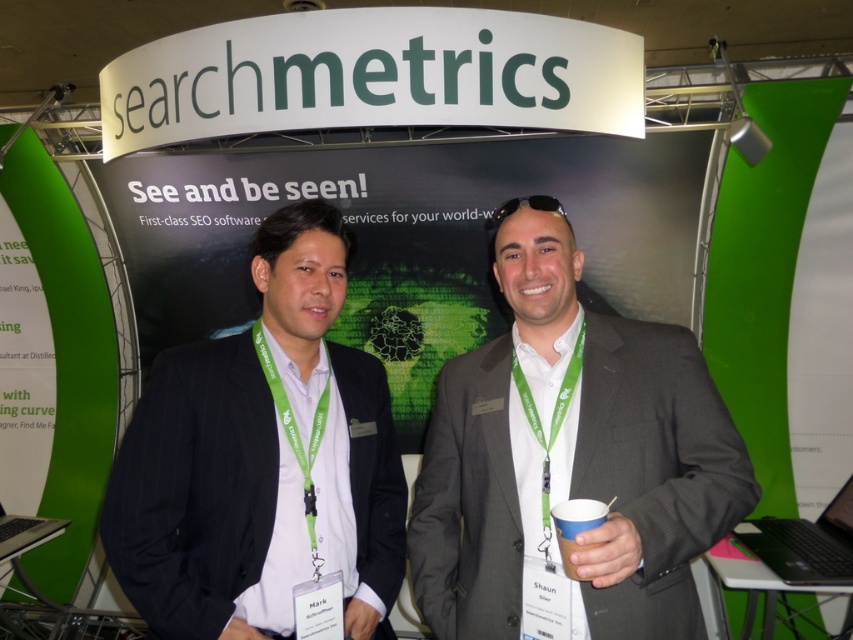
The image size is (853, 640). What do you see at coordinates (805, 544) in the screenshot?
I see `black plastic laptop at lower right` at bounding box center [805, 544].

Is the position of black plastic laptop at lower right more distant than that of blue paper cup at right?

Yes, it is.

The height and width of the screenshot is (640, 853). Describe the element at coordinates (805, 544) in the screenshot. I see `black plastic laptop at lower right` at that location.

Image resolution: width=853 pixels, height=640 pixels. What are the coordinates of `black plastic laptop at lower right` in the screenshot? It's located at (805, 544).

Between dark gray pinstripe suit at center and blue paper cup at right, which one is positioned lower?

blue paper cup at right

You are a GUI agent. You are given a task and a screenshot of the screen. Output one action in this format:
    pyautogui.click(x=<x>, y=<y>)
    Task: Click on the dark gray pinstripe suit at center
    
    Given the screenshot: What is the action you would take?
    pyautogui.click(x=260, y=460)

Where is `dark gray pinstripe suit at center`? dark gray pinstripe suit at center is located at coordinates (260, 460).

Who is positioned more to the right, gray suit at center or silver metallic laptop at lower left?

Positioned to the right is gray suit at center.

Who is more distant from viewer, (682, 557) or (41, 524)?

Positioned behind is point (41, 524).

Does point (538, 476) come closer to viewer compared to point (33, 516)?

Yes, it is.

Where is `gray suit at center`? gray suit at center is located at coordinates (572, 458).